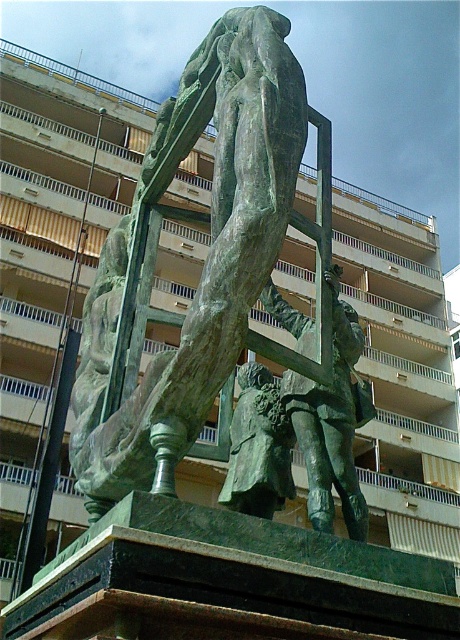
Who is higher up, bronze sculpture at center or green patina statue at center?

bronze sculpture at center

Locate an element on the screen. This screenshot has width=460, height=640. bronze sculpture at center is located at coordinates (207, 256).

Is point (212, 275) positioned behind point (371, 416)?

No, it is not.

Where is `bronze sculpture at center`? bronze sculpture at center is located at coordinates (207, 256).